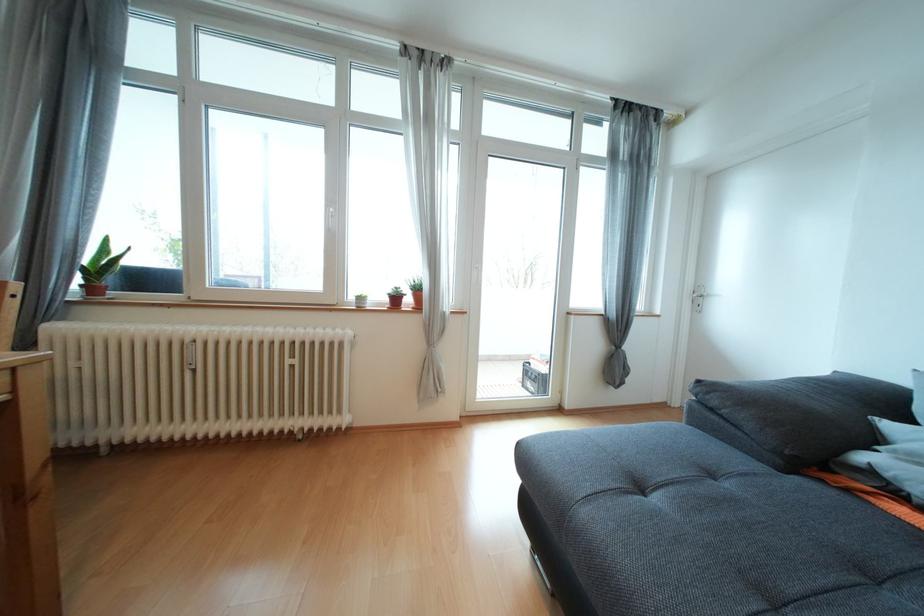
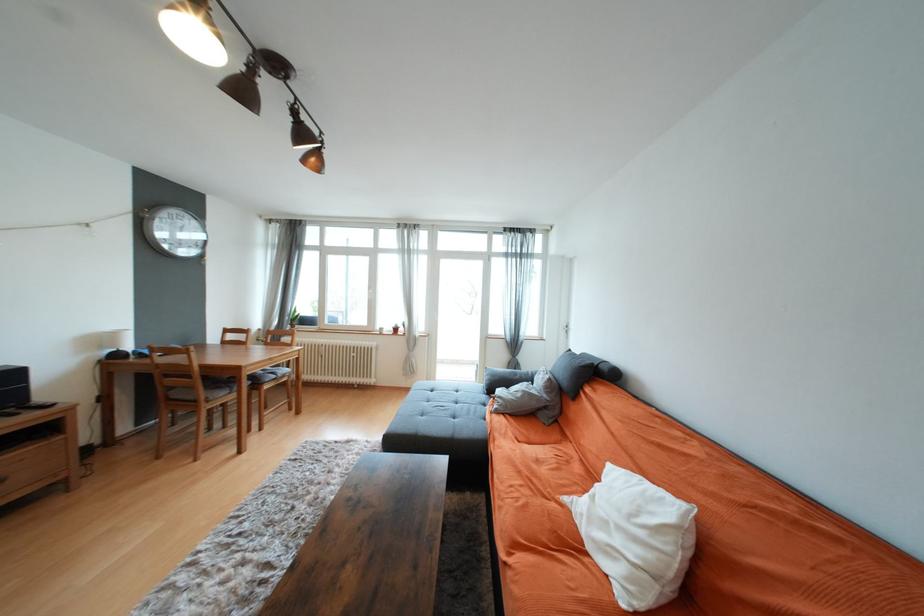
In a continuous first-person perspective shot, in which direction is the camera moving?

The movement direction of the cameraman is right, backward.